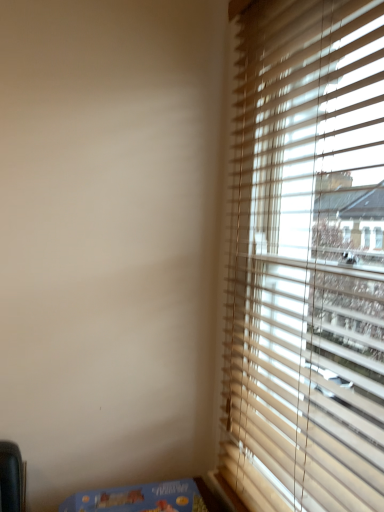
In order to face blue cardboard box at lower left, should I rotate leftwards or rightwards?

Rotate your view left by about 7.189°.

Describe the element at coordinates (147, 498) in the screenshot. The height and width of the screenshot is (512, 384). I see `blue cardboard box at lower left` at that location.

The image size is (384, 512). Identify the location of blue cardboard box at lower left. (147, 498).

Describe the element at coordinates (306, 259) in the screenshot. This screenshot has width=384, height=512. I see `wooden blinds at right` at that location.

Locate an element on the screen. The height and width of the screenshot is (512, 384). wooden blinds at right is located at coordinates (306, 259).

The image size is (384, 512). Identify the location of blue cardboard box at lower left. (147, 498).

Looking at this image, in the image, is wooden blinds at right on the left side or the right side of blue cardboard box at lower left?

Clearly, wooden blinds at right is on the right of blue cardboard box at lower left in the image.

Relative to blue cardboard box at lower left, is wooden blinds at right in front or behind?

In the image, wooden blinds at right appears in front of blue cardboard box at lower left.

Considering the positions of points (289, 250) and (159, 497), is point (289, 250) closer to camera compared to point (159, 497)?

No.

From the image's perspective, which object appears higher, wooden blinds at right or blue cardboard box at lower left?

wooden blinds at right is shown above in the image.

From a real-world perspective, is wooden blinds at right physically above blue cardboard box at lower left?

Indeed, from a real-world perspective, wooden blinds at right stands above blue cardboard box at lower left.

Which object is thinner, wooden blinds at right or blue cardboard box at lower left?

With smaller width is wooden blinds at right.

Considering the sizes of objects wooden blinds at right and blue cardboard box at lower left in the image provided, who is taller, wooden blinds at right or blue cardboard box at lower left?

wooden blinds at right is taller.

Is wooden blinds at right smaller than blue cardboard box at lower left?

No, wooden blinds at right is not smaller than blue cardboard box at lower left.

Is wooden blinds at right inside the boundaries of blue cardboard box at lower left, or outside?

The correct answer is: outside.

Is wooden blinds at right in contact with blue cardboard box at lower left?

No.

Is wooden blinds at right oriented towards blue cardboard box at lower left?

Yes, wooden blinds at right is turned towards blue cardboard box at lower left.

Where is `table on the left of the wooden blinds at right`? The width and height of the screenshot is (384, 512). table on the left of the wooden blinds at right is located at coordinates (147, 498).

Is blue cardboard box at lower left at the right side of wooden blinds at right?

Incorrect, blue cardboard box at lower left is not on the right side of wooden blinds at right.

Is blue cardboard box at lower left positioned in front of wooden blinds at right?

No.

Which is behind, point (108, 504) or point (370, 61)?

Point (108, 504)

From the image's perspective, is blue cardboard box at lower left above or below wooden blinds at right?

Based on their image positions, blue cardboard box at lower left is located beneath wooden blinds at right.

From a real-world perspective, who is located lower, blue cardboard box at lower left or wooden blinds at right?

blue cardboard box at lower left, from a real-world perspective.

Based on the photo, between blue cardboard box at lower left and wooden blinds at right, which one has larger width?

blue cardboard box at lower left is wider.

Considering the sizes of blue cardboard box at lower left and wooden blinds at right in the image, is blue cardboard box at lower left taller or shorter than wooden blinds at right?

In the image, blue cardboard box at lower left appears to be shorter than wooden blinds at right.

Does blue cardboard box at lower left have a smaller size compared to wooden blinds at right?

Indeed, blue cardboard box at lower left has a smaller size compared to wooden blinds at right.

Is blue cardboard box at lower left inside or outside of wooden blinds at right?

blue cardboard box at lower left is spatially situated outside wooden blinds at right.

Is blue cardboard box at lower left in contact with wooden blinds at right?

No, blue cardboard box at lower left is not making contact with wooden blinds at right.

Is blue cardboard box at lower left facing away from wooden blinds at right?

No, wooden blinds at right is not at the back of blue cardboard box at lower left.

How many degrees apart are the facing directions of blue cardboard box at lower left and wooden blinds at right?

The angular difference between blue cardboard box at lower left and wooden blinds at right is 90 degrees.

Locate an element on the screen. The image size is (384, 512). table below the wooden blinds at right (from a real-world perspective) is located at coordinates (147, 498).

Locate an element on the screen. The height and width of the screenshot is (512, 384). table that appears below the wooden blinds at right (from the image's perspective) is located at coordinates (147, 498).

The height and width of the screenshot is (512, 384). Identify the location of window above the blue cardboard box at lower left (from a real-world perspective). (306, 259).